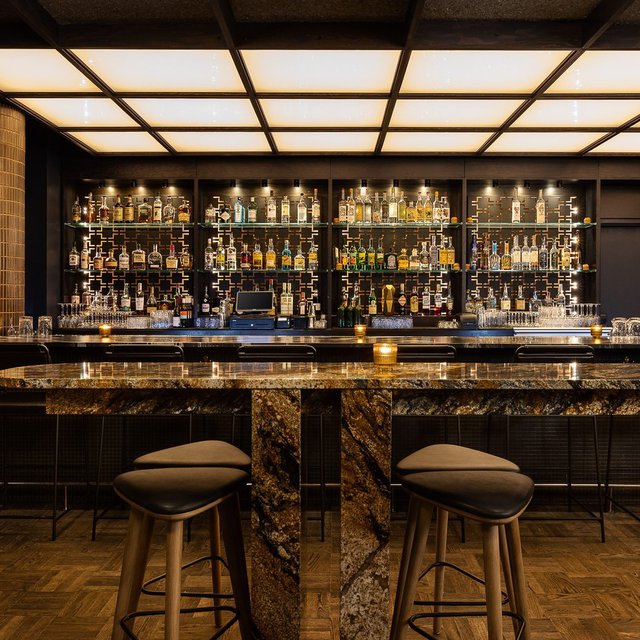
Image resolution: width=640 pixels, height=640 pixels. Identify the location of glowing votive candle. (102, 335), (388, 358), (353, 328), (596, 331).